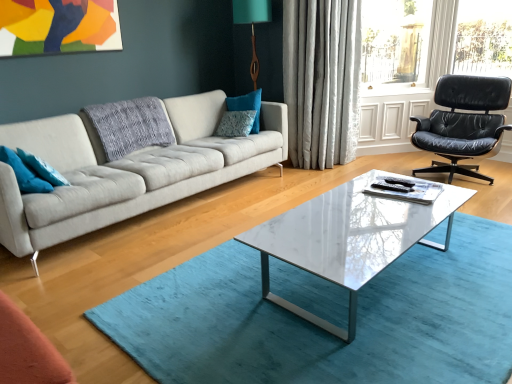
Question: Considering the positions of teal fabric pillow at center, the first pillow when ordered from back to front, and black leather chair at right in the image, is teal fabric pillow at center, the first pillow when ordered from back to front, wider or thinner than black leather chair at right?

Choices:
 (A) thin
 (B) wide

Answer: (A)

Question: Is point (256, 97) positioned closer to the camera than point (472, 89)?

Choices:
 (A) farther
 (B) closer

Answer: (B)

Question: Estimate the real-world distances between objects in this image. Which object is farther from the teal fabric pillow at left, acting as the second pillow starting from the front?

Choices:
 (A) light gray fabric couch at center
 (B) teal fabric pillow at center, placed as the fourth pillow when sorted from left to right
 (C) transparent glass window screen at upper right
 (D) black leather chair at right
 (E) white marble coffee table at center

Answer: (C)

Question: Considering the real-world distances, which object is closest to the white marble coffee table at center?

Choices:
 (A) light gray fabric couch at center
 (B) silky gray curtain at upper right
 (C) transparent glass window screen at upper right
 (D) teal fabric pillow at left, placed as the third pillow when sorted from right to left
 (E) black leather chair at right

Answer: (A)